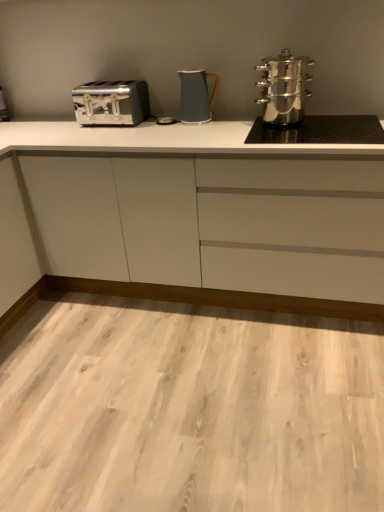
Consider the image. Measure the distance between satin chrome toaster at left and camera.

The depth of satin chrome toaster at left is 2.13 meters.

Locate an element on the screen. The image size is (384, 512). matte blue pitcher at center, arranged as the second kitchen appliance when viewed from the right is located at coordinates (196, 96).

Is white matte cabinet at center oriented away from polished stainless steel steamer at right, the second kitchen appliance when ordered from left to right?

That's not correct — white matte cabinet at center is not looking away from polished stainless steel steamer at right, the second kitchen appliance when ordered from left to right.

From the image's perspective, who appears lower, white matte cabinet at center or polished stainless steel steamer at right, the second kitchen appliance when ordered from left to right?

From the image's view, white matte cabinet at center is below.

Where is `cabinetry lying in front of the polished stainless steel steamer at right, the second kitchen appliance when ordered from left to right`? This screenshot has height=512, width=384. cabinetry lying in front of the polished stainless steel steamer at right, the second kitchen appliance when ordered from left to right is located at coordinates (167, 144).

Would you say matte blue pitcher at center, arranged as the second kitchen appliance when viewed from the right, is inside or outside satin chrome toaster at left?

matte blue pitcher at center, arranged as the second kitchen appliance when viewed from the right, is not inside satin chrome toaster at left, it's outside.

From the picture: From the image's perspective, which one is positioned higher, matte blue pitcher at center, arranged as the second kitchen appliance when viewed from the right, or satin chrome toaster at left?

satin chrome toaster at left, from the image's perspective.

Is matte blue pitcher at center, marked as the first kitchen appliance in a left-to-right arrangement, to the left of satin chrome toaster at left from the viewer's perspective?

In fact, matte blue pitcher at center, marked as the first kitchen appliance in a left-to-right arrangement, is to the right of satin chrome toaster at left.

Considering the positions of objects polished stainless steel steamer at right, the second kitchen appliance when ordered from left to right, and satin chrome toaster at left in the image provided, who is behind, polished stainless steel steamer at right, the second kitchen appliance when ordered from left to right, or satin chrome toaster at left?

Positioned behind is satin chrome toaster at left.

Could you tell me if polished stainless steel steamer at right, which is counted as the 1th kitchen appliance, starting from the right, is facing satin chrome toaster at left?

No, polished stainless steel steamer at right, which is counted as the 1th kitchen appliance, starting from the right, is not oriented towards satin chrome toaster at left.

Does polished stainless steel steamer at right, the second kitchen appliance when ordered from left to right, touch satin chrome toaster at left?

No, polished stainless steel steamer at right, the second kitchen appliance when ordered from left to right, is not beside satin chrome toaster at left.

Does matte blue pitcher at center, arranged as the second kitchen appliance when viewed from the right, appear on the right side of polished stainless steel steamer at right, which is counted as the 1th kitchen appliance, starting from the right?

In fact, matte blue pitcher at center, arranged as the second kitchen appliance when viewed from the right, is to the left of polished stainless steel steamer at right, which is counted as the 1th kitchen appliance, starting from the right.

Looking at their sizes, would you say matte blue pitcher at center, arranged as the second kitchen appliance when viewed from the right, is wider or thinner than polished stainless steel steamer at right, the second kitchen appliance when ordered from left to right?

In the image, matte blue pitcher at center, arranged as the second kitchen appliance when viewed from the right, appears to be more narrow than polished stainless steel steamer at right, the second kitchen appliance when ordered from left to right.

Could you tell me if matte blue pitcher at center, marked as the first kitchen appliance in a left-to-right arrangement, is facing polished stainless steel steamer at right, which is counted as the 1th kitchen appliance, starting from the right?

No, matte blue pitcher at center, marked as the first kitchen appliance in a left-to-right arrangement, is not oriented towards polished stainless steel steamer at right, which is counted as the 1th kitchen appliance, starting from the right.

From a real-world perspective, is matte blue pitcher at center, arranged as the second kitchen appliance when viewed from the right, under polished stainless steel steamer at right, the second kitchen appliance when ordered from left to right?

Indeed, from a real-world perspective, matte blue pitcher at center, arranged as the second kitchen appliance when viewed from the right, is positioned beneath polished stainless steel steamer at right, the second kitchen appliance when ordered from left to right.

Can you confirm if satin chrome toaster at left is smaller than matte blue pitcher at center, marked as the first kitchen appliance in a left-to-right arrangement?

Actually, satin chrome toaster at left might be larger than matte blue pitcher at center, marked as the first kitchen appliance in a left-to-right arrangement.

Does satin chrome toaster at left have a greater width compared to matte blue pitcher at center, marked as the first kitchen appliance in a left-to-right arrangement?

Yes, satin chrome toaster at left is wider than matte blue pitcher at center, marked as the first kitchen appliance in a left-to-right arrangement.

From the image's perspective, is satin chrome toaster at left on top of matte blue pitcher at center, marked as the first kitchen appliance in a left-to-right arrangement?

Indeed, from the image's perspective, satin chrome toaster at left is shown above matte blue pitcher at center, marked as the first kitchen appliance in a left-to-right arrangement.

Choose the correct answer: Is matte blue pitcher at center, arranged as the second kitchen appliance when viewed from the right, inside white matte cabinet at center or outside it?

matte blue pitcher at center, arranged as the second kitchen appliance when viewed from the right, is not inside white matte cabinet at center, it's outside.

Where is `cabinetry located below the matte blue pitcher at center, arranged as the second kitchen appliance when viewed from the right (from the image's perspective)`? cabinetry located below the matte blue pitcher at center, arranged as the second kitchen appliance when viewed from the right (from the image's perspective) is located at coordinates (167, 144).

Can you see matte blue pitcher at center, marked as the first kitchen appliance in a left-to-right arrangement, touching white matte cabinet at center?

There is a gap between matte blue pitcher at center, marked as the first kitchen appliance in a left-to-right arrangement, and white matte cabinet at center.

From a real-world perspective, which object rests below the other?

white matte cabinet at center.

Which is less distant, (154, 147) or (97, 89)?

The point (154, 147) is in front.

Does white matte cabinet at center have a greater width compared to satin chrome toaster at left?

Yes.

Can you confirm if white matte cabinet at center is taller than satin chrome toaster at left?

Correct, white matte cabinet at center is much taller as satin chrome toaster at left.

How different are the orientations of white matte cabinet at center and satin chrome toaster at left in degrees?

They differ by 0.0018 degrees in their facing directions.

At what (x,y) coordinates should I click in order to perform the action: click on cabinetry that is in front of the polished stainless steel steamer at right, the second kitchen appliance when ordered from left to right. Please return your answer as a coordinate pair (x, y). Looking at the image, I should click on (167, 144).

Where is `the 1st kitchen appliance located above the satin chrome toaster at left (from a real-world perspective)`? This screenshot has height=512, width=384. the 1st kitchen appliance located above the satin chrome toaster at left (from a real-world perspective) is located at coordinates (196, 96).

From the image, which object appears to be farther from satin silver toaster at left, white matte cabinet at center or matte blue pitcher at center, marked as the first kitchen appliance in a left-to-right arrangement?

The object further to satin silver toaster at left is matte blue pitcher at center, marked as the first kitchen appliance in a left-to-right arrangement.

Estimate the real-world distances between objects in this image. Which object is closer to matte blue pitcher at center, marked as the first kitchen appliance in a left-to-right arrangement, satin chrome toaster at left or white matte cabinet at center?

Among the two, satin chrome toaster at left is located nearer to matte blue pitcher at center, marked as the first kitchen appliance in a left-to-right arrangement.

Based on their spatial positions, is matte blue pitcher at center, marked as the first kitchen appliance in a left-to-right arrangement, or polished stainless steel steamer at right, the second kitchen appliance when ordered from left to right, closer to satin silver toaster at left?

matte blue pitcher at center, marked as the first kitchen appliance in a left-to-right arrangement, is closer to satin silver toaster at left.

Estimate the real-world distances between objects in this image. Which object is further from satin chrome toaster at left, matte blue pitcher at center, marked as the first kitchen appliance in a left-to-right arrangement, or polished stainless steel steamer at right, which is counted as the 1th kitchen appliance, starting from the right?

The object further to satin chrome toaster at left is polished stainless steel steamer at right, which is counted as the 1th kitchen appliance, starting from the right.

From the image, which object appears to be nearer to satin chrome toaster at left, satin silver toaster at left or white matte cabinet at center?

white matte cabinet at center is positioned closer to the anchor satin chrome toaster at left.

Which object lies nearer to the anchor point satin silver toaster at left, polished stainless steel steamer at right, which is counted as the 1th kitchen appliance, starting from the right, or matte blue pitcher at center, marked as the first kitchen appliance in a left-to-right arrangement?

matte blue pitcher at center, marked as the first kitchen appliance in a left-to-right arrangement, is closer to satin silver toaster at left.

Considering their positions, is white matte cabinet at center positioned closer to matte blue pitcher at center, arranged as the second kitchen appliance when viewed from the right, than polished stainless steel steamer at right, the second kitchen appliance when ordered from left to right?

The object closer to matte blue pitcher at center, arranged as the second kitchen appliance when viewed from the right, is polished stainless steel steamer at right, the second kitchen appliance when ordered from left to right.

Considering their positions, is satin silver toaster at left positioned further to white matte cabinet at center than polished stainless steel steamer at right, the second kitchen appliance when ordered from left to right?

satin silver toaster at left.

Find the location of a particular element. This screenshot has height=512, width=384. kitchen appliance between satin chrome toaster at left and polished stainless steel steamer at right, which is counted as the 1th kitchen appliance, starting from the right is located at coordinates (196, 96).

Identify the location of kitchen appliance located between satin silver toaster at left and white matte cabinet at center in the left-right direction. (196, 96).

In order to click on toaster between satin silver toaster at left and polished stainless steel steamer at right, which is counted as the 1th kitchen appliance, starting from the right, in the horizontal direction in this screenshot , I will do `click(111, 103)`.

Identify the location of toaster between satin silver toaster at left and white matte cabinet at center. The width and height of the screenshot is (384, 512). (111, 103).